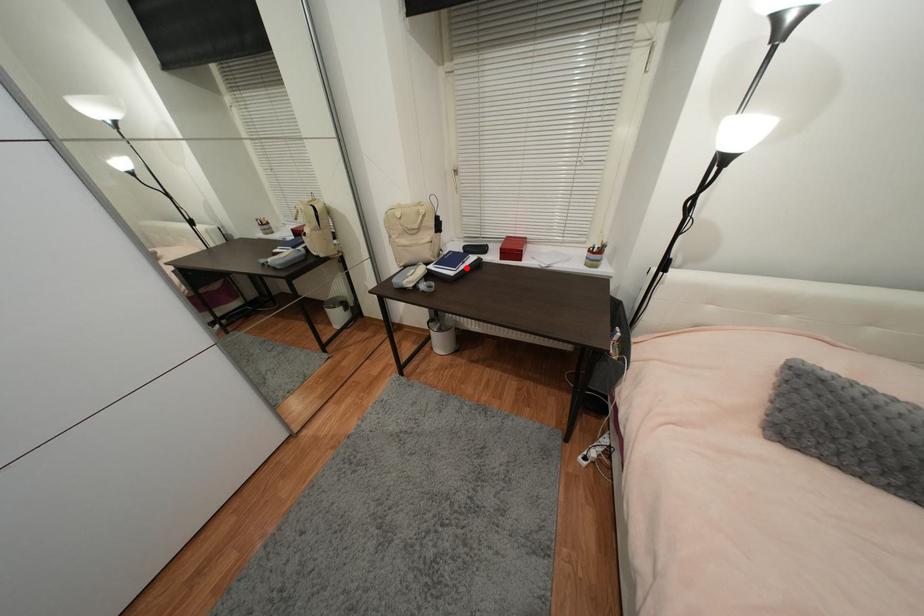
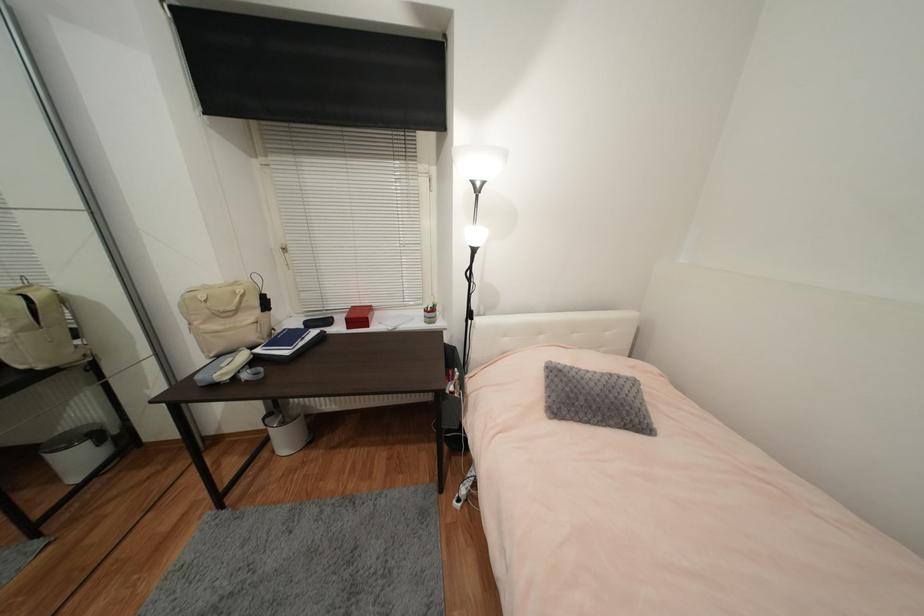
In the second image, find the point that corresponds to the highlighted location in the first image.

(306, 344)